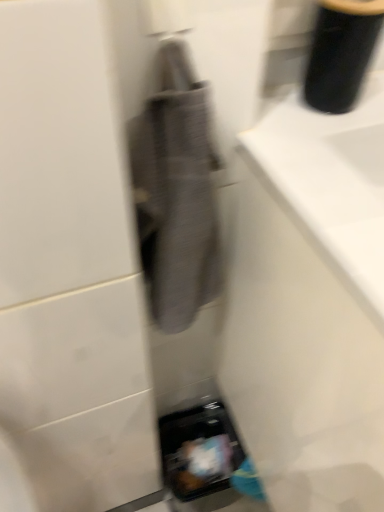
Where is `matte black phone at lower right`? matte black phone at lower right is located at coordinates (199, 451).

What do you see at coordinates (199, 451) in the screenshot? I see `matte black phone at lower right` at bounding box center [199, 451].

Where is `matte black phone at lower right`? This screenshot has width=384, height=512. matte black phone at lower right is located at coordinates (199, 451).